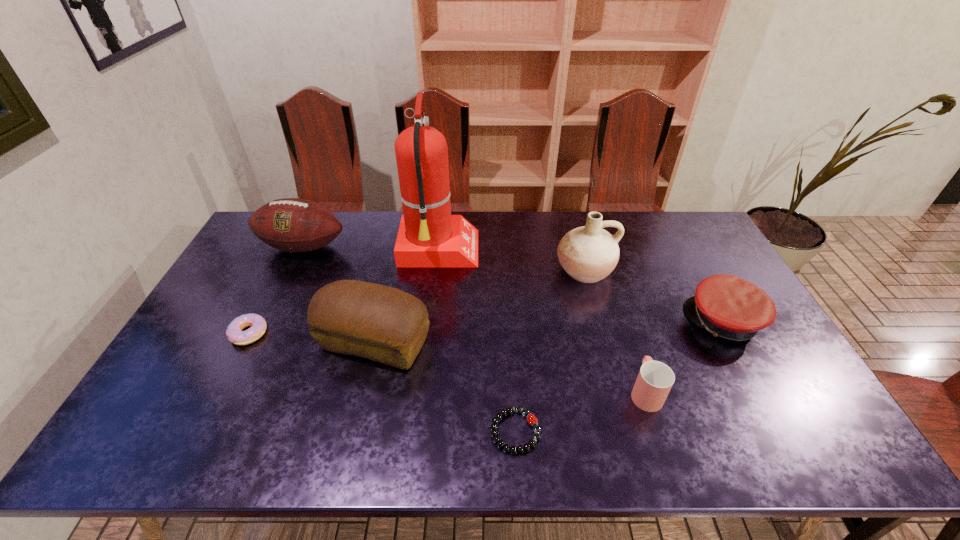
Where is `vacant space located 0.290m on the right of the fourth object from right to left`? vacant space located 0.290m on the right of the fourth object from right to left is located at coordinates (664, 431).

Find the location of `fire extinguisher present at the far edge`. fire extinguisher present at the far edge is located at coordinates (429, 236).

In order to click on football (American) that is at the far edge in this screenshot , I will do click(x=293, y=225).

Where is `object located in the near edge section of the desktop`? The height and width of the screenshot is (540, 960). object located in the near edge section of the desktop is located at coordinates (532, 420).

At what (x,y) coordinates should I click in order to perform the action: click on football (American) present at the left edge. Please return your answer as a coordinate pair (x, y). The height and width of the screenshot is (540, 960). Looking at the image, I should click on (293, 225).

Locate an element on the screen. This screenshot has width=960, height=540. doughnut present at the left edge is located at coordinates (257, 324).

Where is `object at the right edge`? The height and width of the screenshot is (540, 960). object at the right edge is located at coordinates (727, 306).

Identify the location of object present at the far left corner. (293, 225).

The height and width of the screenshot is (540, 960). In order to click on vacant space at the far edge of the desktop in this screenshot , I will do `click(634, 218)`.

At what (x,y) coordinates should I click in order to perform the action: click on vacant area at the near edge. Please return your answer as a coordinate pair (x, y). Looking at the image, I should click on (390, 428).